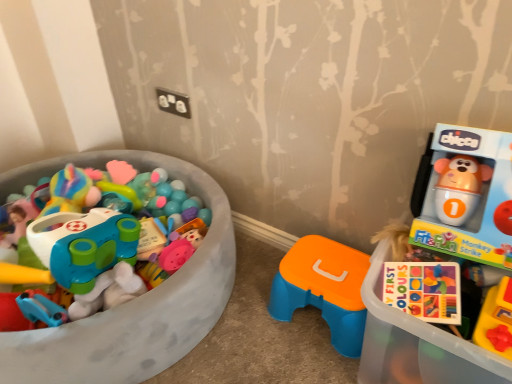
Question: Is matte plastic toy car at left, the 2th toy in the right-to-left sequence, at the back of matte plastic toy at right?

Choices:
 (A) no
 (B) yes

Answer: (A)

Question: Can you confirm if matte plastic toy at right is positioned to the left of matte plastic toy car at left, which appears as the first toy when viewed from the left?

Choices:
 (A) no
 (B) yes

Answer: (A)

Question: Considering the relative sizes of matte plastic toy at right and matte plastic toy car at left, which appears as the first toy when viewed from the left, in the image provided, is matte plastic toy at right taller than matte plastic toy car at left, which appears as the first toy when viewed from the left,?

Choices:
 (A) no
 (B) yes

Answer: (A)

Question: Considering the relative sizes of matte plastic toy at right and matte plastic toy car at left, which appears as the first toy when viewed from the left, in the image provided, is matte plastic toy at right smaller than matte plastic toy car at left, which appears as the first toy when viewed from the left,?

Choices:
 (A) yes
 (B) no

Answer: (A)

Question: From a real-world perspective, is matte plastic toy at right on matte plastic toy car at left, which appears as the first toy when viewed from the left?

Choices:
 (A) no
 (B) yes

Answer: (B)

Question: Can you confirm if matte plastic toy at right is shorter than matte plastic toy car at left, the 2th toy in the right-to-left sequence?

Choices:
 (A) no
 (B) yes

Answer: (B)

Question: Is orange plastic stool at center, the first toy positioned from the right, completely or partially outside of matte plastic toy car at left, which appears as the first toy when viewed from the left?

Choices:
 (A) no
 (B) yes

Answer: (B)

Question: Is orange plastic stool at center, the first toy positioned from the right, at the right side of matte plastic toy car at left, which appears as the first toy when viewed from the left?

Choices:
 (A) no
 (B) yes

Answer: (B)

Question: Is the depth of orange plastic stool at center, the first toy positioned from the right, less than that of matte plastic toy car at left, which appears as the first toy when viewed from the left?

Choices:
 (A) yes
 (B) no

Answer: (B)

Question: Is orange plastic stool at center, the first toy positioned from the right, taller than matte plastic toy car at left, the 2th toy in the right-to-left sequence?

Choices:
 (A) no
 (B) yes

Answer: (A)

Question: Can you confirm if orange plastic stool at center, the first toy positioned from the right, is smaller than matte plastic toy car at left, which appears as the first toy when viewed from the left?

Choices:
 (A) no
 (B) yes

Answer: (B)

Question: Is orange plastic stool at center, the first toy positioned from the right, placed right next to matte plastic toy car at left, which appears as the first toy when viewed from the left?

Choices:
 (A) no
 (B) yes

Answer: (A)

Question: From a real-world perspective, is matte plastic toy car at left, the 2th toy in the right-to-left sequence, positioned under orange plastic stool at center, the first toy positioned from the right, based on gravity?

Choices:
 (A) yes
 (B) no

Answer: (B)